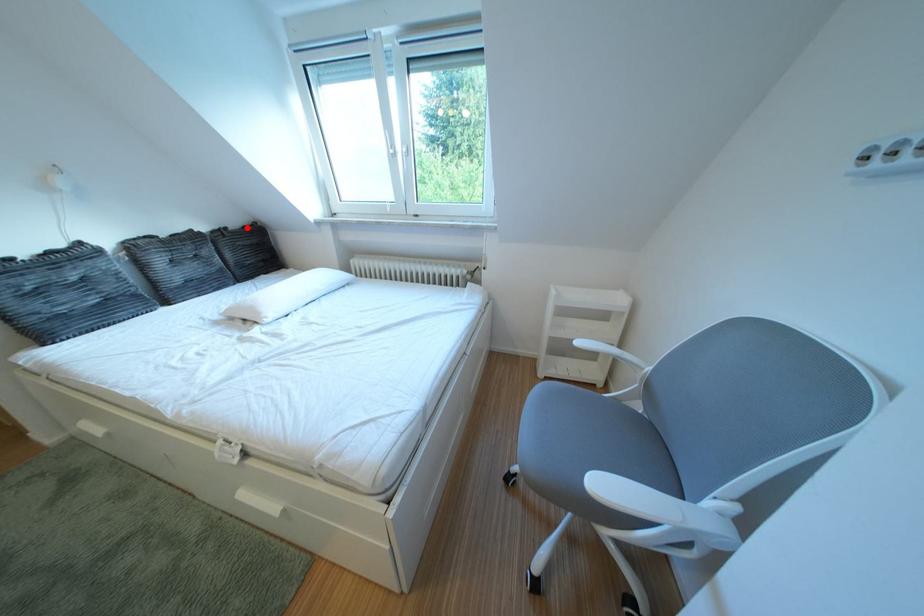
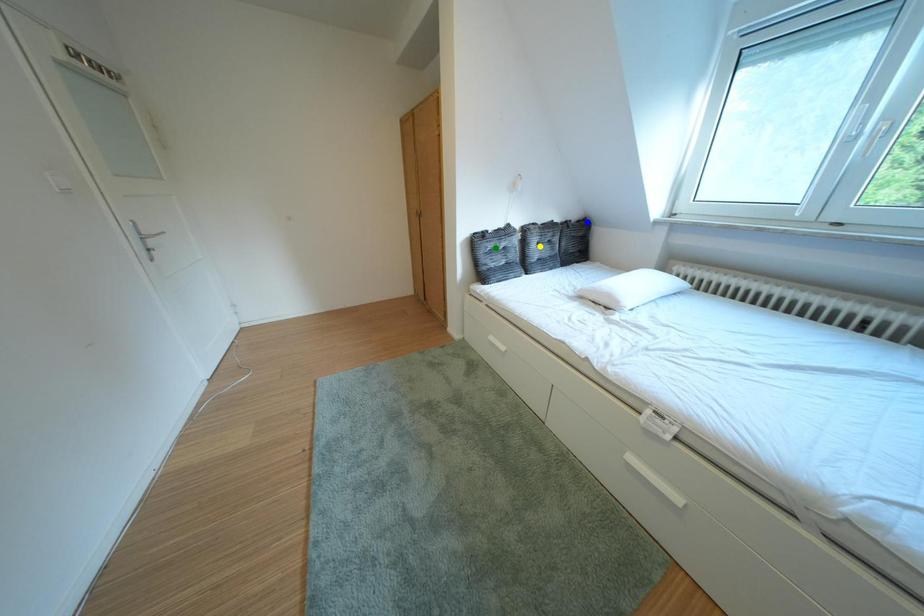
Question: I am providing you with two images of the same scene from different viewpoints. A red point is marked on the first image. You are given multiple points on the second image. Can you choose the point in image 2 that corresponds to the point in image 1?

Choices:
 (A) yellow point
 (B) green point
 (C) blue point

Answer: (C)